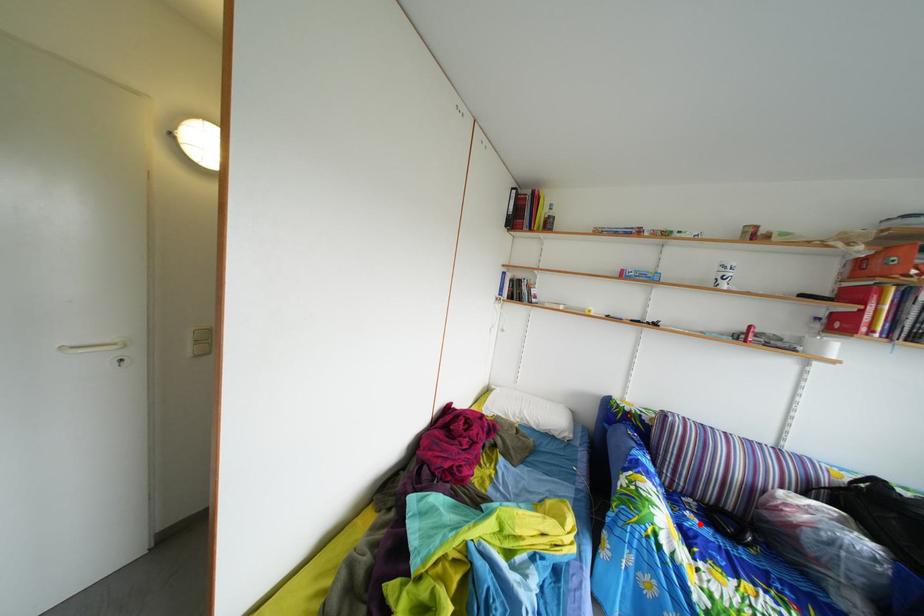
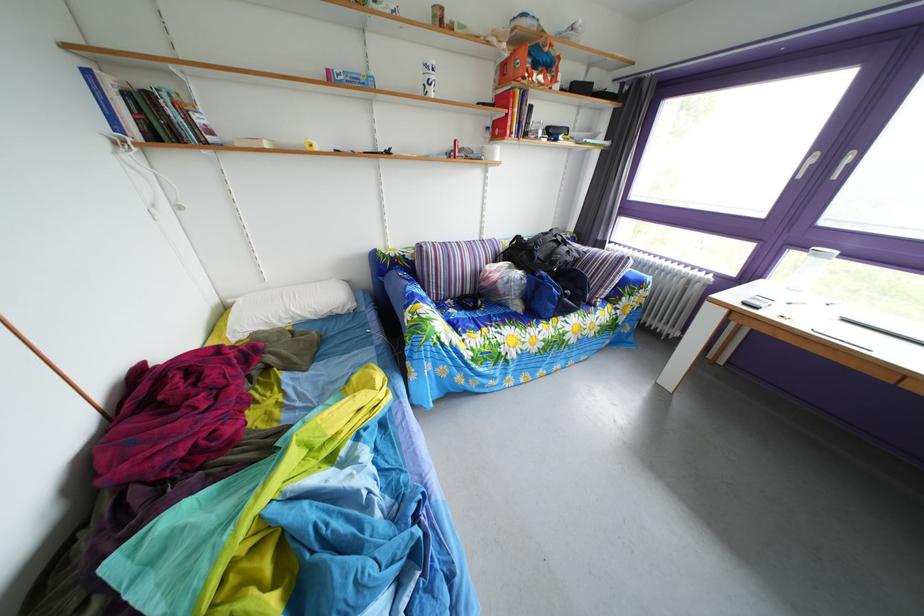
The point at the highlighted location is marked in the first image. Where is the corresponding point in the second image?

(463, 320)